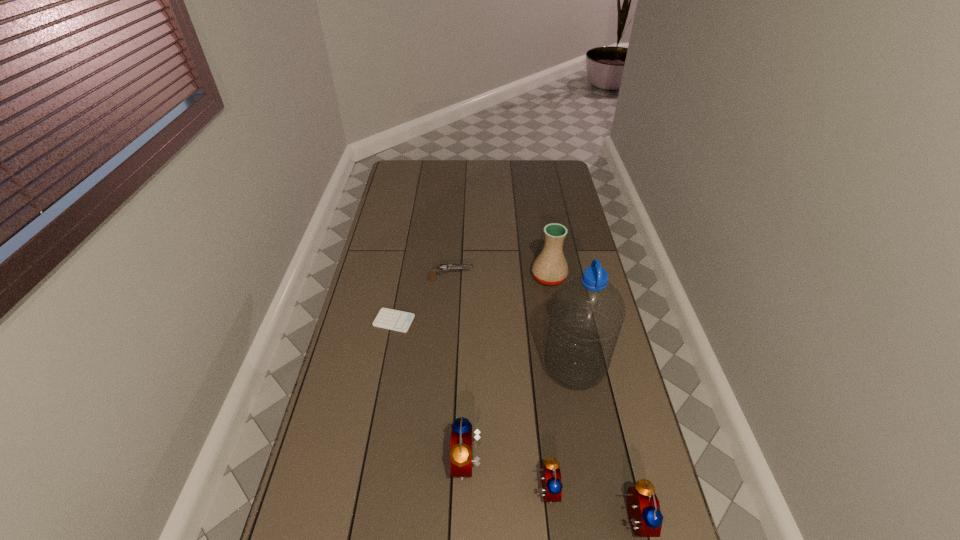
Find the location of a particular element. This screenshot has height=540, width=960. free spot located on the front-facing side of the leftmost alarm clock is located at coordinates (381, 463).

The height and width of the screenshot is (540, 960). I want to click on vacant position located 0.240m on the front-facing side of the leftmost alarm clock, so click(x=363, y=463).

What are the coordinates of `free space located on the front-facing side of the shortest alarm clock` in the screenshot? It's located at (604, 490).

The height and width of the screenshot is (540, 960). In order to click on vacant space located on the left of the sixth shortest object in this screenshot , I will do `click(462, 277)`.

You are a GUI agent. You are given a task and a screenshot of the screen. Output one action in this format:
    pyautogui.click(x=<x>, y=<y>)
    Task: Click on the vacant space situated on the back of the third farthest object
    
    Given the screenshot: What is the action you would take?
    pyautogui.click(x=406, y=255)

This screenshot has width=960, height=540. I want to click on vacant position located 0.280m aiming along the barrel of the sixth tallest object, so click(546, 279).

Locate an element on the screen. The height and width of the screenshot is (540, 960). free region located 0.080m on the front of the tallest object is located at coordinates (584, 420).

Locate an element on the screen. object located in the near edge section of the desktop is located at coordinates (552, 485).

This screenshot has height=540, width=960. Find the location of `object at the left edge`. object at the left edge is located at coordinates (390, 319).

The image size is (960, 540). I want to click on pottery present at the right edge, so (550, 267).